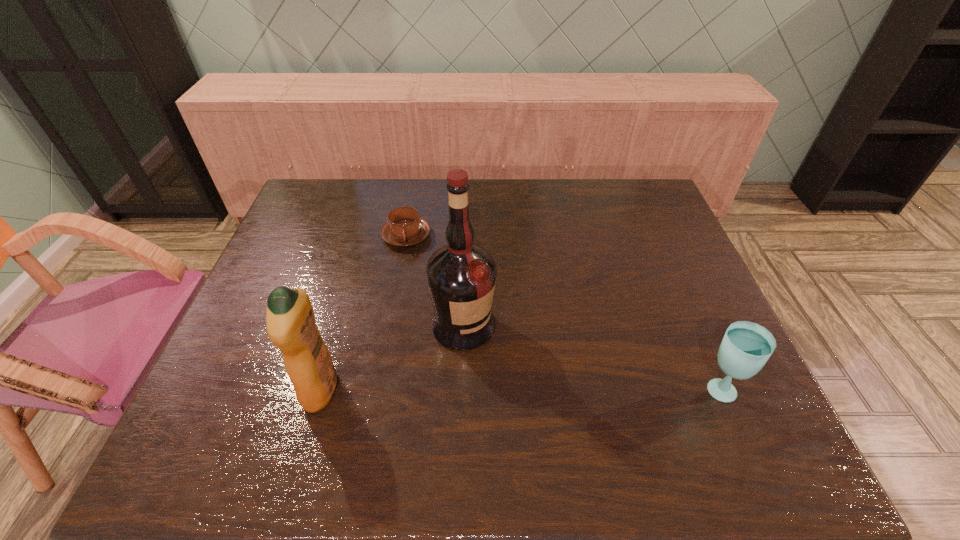
I want to click on blank area located 0.060m on the label of the second tallest object, so click(278, 389).

In order to click on free point located 0.160m on the back of the second shortest object in this screenshot , I will do `click(686, 319)`.

Image resolution: width=960 pixels, height=540 pixels. I want to click on vacant space located on the side of the shortest object with the handle, so coord(450,313).

Locate an element on the screen. The height and width of the screenshot is (540, 960). vacant area situated 0.390m on the side of the shortest object with the handle is located at coordinates (469, 347).

Identify the location of vacant point located on the side of the shortest object with the handle. The image size is (960, 540). (432, 281).

The height and width of the screenshot is (540, 960). Identify the location of free space located 0.240m on the surface of the third object from left to right. (561, 412).

Locate an element on the screen. free location located 0.080m on the surface of the third object from left to right is located at coordinates (509, 365).

At what (x,y) coordinates should I click in order to perform the action: click on vacant area situated 0.120m on the surface of the third object from left to right. Please return your answer as a coordinate pair (x, y). The height and width of the screenshot is (540, 960). Looking at the image, I should click on tap(520, 376).

The image size is (960, 540). What are the coordinates of `object at the far edge` in the screenshot? It's located at (404, 228).

What are the coordinates of `detergent at the near edge` in the screenshot? It's located at (290, 321).